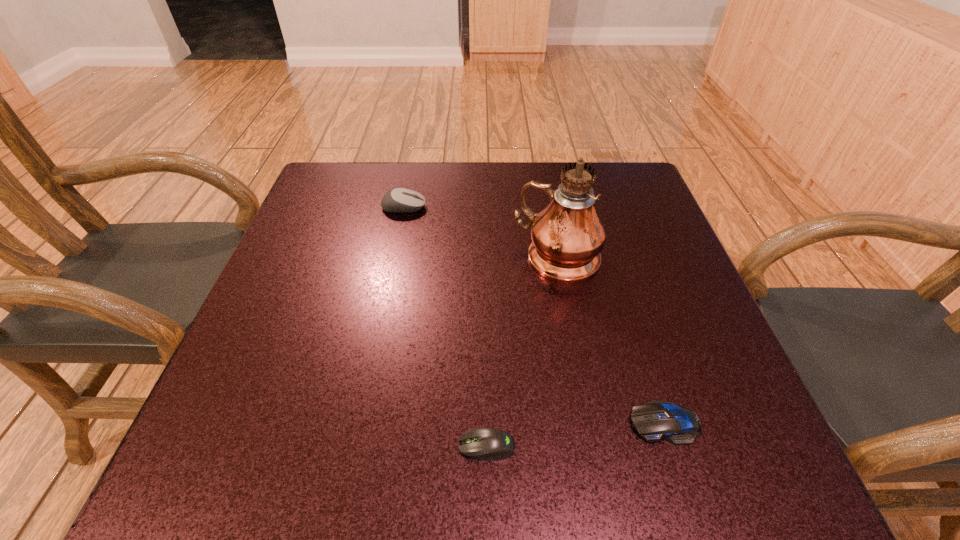
Locate an element on the screen. The width and height of the screenshot is (960, 540). free location at the right edge is located at coordinates (669, 348).

The width and height of the screenshot is (960, 540). In the image, there is a desktop. In order to click on vacant space at the far left corner in this screenshot , I will do `click(322, 198)`.

You are a GUI agent. You are given a task and a screenshot of the screen. Output one action in this format:
    pyautogui.click(x=<x>, y=<y>)
    Task: Click on the vacant space at the near left corner of the desktop
    Image resolution: width=960 pixels, height=540 pixels.
    Given the screenshot: What is the action you would take?
    pyautogui.click(x=206, y=456)

Identify the location of vacant space at the far right corner. The width and height of the screenshot is (960, 540). point(595,197).

Where is `vacant space at the near right corner`? vacant space at the near right corner is located at coordinates (674, 460).

At what (x,y) coordinates should I click in order to perform the action: click on free space between the second object from left to right and the oil lamp. Please return your answer as a coordinate pair (x, y). The height and width of the screenshot is (540, 960). Looking at the image, I should click on (522, 352).

Identify the location of free spot between the rightmost computer mouse and the second computer mouse from left to right. (575, 434).

Where is `vacant area that lies between the rightmost computer mouse and the second object from left to right`? vacant area that lies between the rightmost computer mouse and the second object from left to right is located at coordinates (575, 434).

The width and height of the screenshot is (960, 540). I want to click on vacant area that lies between the third object from right to left and the rightmost computer mouse, so click(575, 434).

Locate an element on the screen. free spot between the second object from left to right and the tallest computer mouse is located at coordinates (445, 326).